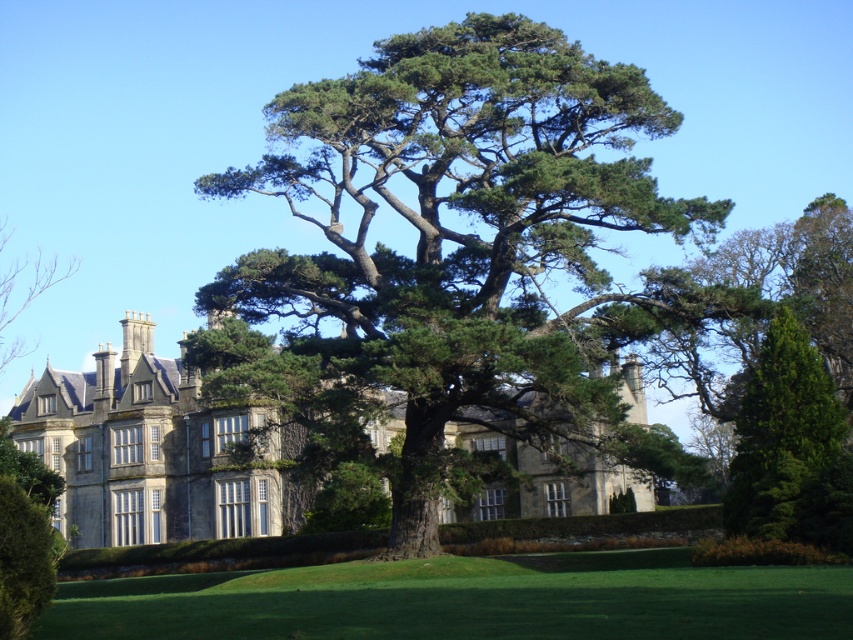
Question: Which object appears closest to the camera in this image?

Choices:
 (A) green leafy hedge at lower left
 (B) stone mansion at center
 (C) green grass at center
 (D) green leafy hedge at lower right

Answer: (C)

Question: Which object is the closest to the green leafy hedge at lower left?

Choices:
 (A) green leafy tree at upper left
 (B) green grass at center
 (C) green leafy hedge at lower right
 (D) green matte evergreen tree at center

Answer: (B)

Question: Does green grass at center have a larger size compared to green leafy hedge at lower right?

Choices:
 (A) no
 (B) yes

Answer: (B)

Question: Can you confirm if green grass at center is bigger than green leafy hedge at lower right?

Choices:
 (A) no
 (B) yes

Answer: (B)

Question: From the image, what is the correct spatial relationship of stone mansion at center in relation to green leafy tree at upper left?

Choices:
 (A) below
 (B) above

Answer: (A)

Question: Which object is farther from the camera taking this photo?

Choices:
 (A) stone mansion at center
 (B) green leafy hedge at lower right
 (C) green leafy hedge at lower left
 (D) green leafy tree at upper left

Answer: (D)